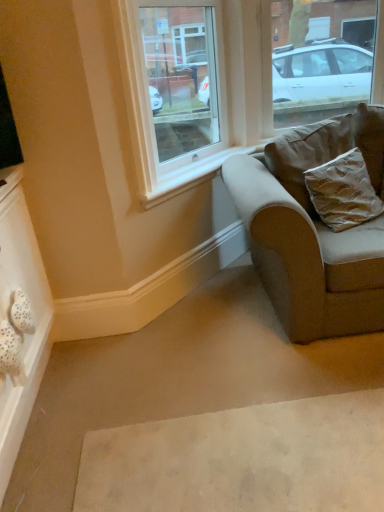
Question: Is gold textured pillow at right in front of clear glass window at upper right, the 1th window from the right?

Choices:
 (A) yes
 (B) no

Answer: (A)

Question: Is gold textured pillow at right next to clear glass window at upper right, acting as the second window starting from the left?

Choices:
 (A) yes
 (B) no

Answer: (B)

Question: From a real-world perspective, is gold textured pillow at right under clear glass window at upper right, the 1th window from the right?

Choices:
 (A) no
 (B) yes

Answer: (B)

Question: From the image's perspective, is gold textured pillow at right under clear glass window at upper right, the 1th window from the right?

Choices:
 (A) no
 (B) yes

Answer: (B)

Question: Does gold textured pillow at right have a larger size compared to clear glass window at upper right, the 1th window from the right?

Choices:
 (A) no
 (B) yes

Answer: (A)

Question: Considering the relative sizes of gold textured pillow at right and clear glass window at upper right, acting as the second window starting from the left, in the image provided, is gold textured pillow at right shorter than clear glass window at upper right, acting as the second window starting from the left,?

Choices:
 (A) no
 (B) yes

Answer: (B)

Question: Is beige fabric couch at right positioned with its back to clear glass window at upper right, the 1th window from the right?

Choices:
 (A) no
 (B) yes

Answer: (A)

Question: Is beige fabric couch at right wider than clear glass window at upper right, the 1th window from the right?

Choices:
 (A) no
 (B) yes

Answer: (B)

Question: From a real-world perspective, is beige fabric couch at right over clear glass window at upper right, the 1th window from the right?

Choices:
 (A) no
 (B) yes

Answer: (A)

Question: Considering the relative sizes of beige fabric couch at right and clear glass window at upper right, the 1th window from the right, in the image provided, is beige fabric couch at right thinner than clear glass window at upper right, the 1th window from the right,?

Choices:
 (A) yes
 (B) no

Answer: (B)

Question: Is beige fabric couch at right to the left of clear glass window at upper right, the 1th window from the right, from the viewer's perspective?

Choices:
 (A) yes
 (B) no

Answer: (A)

Question: Is beige fabric couch at right not close to clear glass window at upper right, acting as the second window starting from the left?

Choices:
 (A) no
 (B) yes

Answer: (B)

Question: Is beige fabric couch at right with clear glass window at upper center, marked as the second window in a right-to-left arrangement?

Choices:
 (A) no
 (B) yes

Answer: (A)